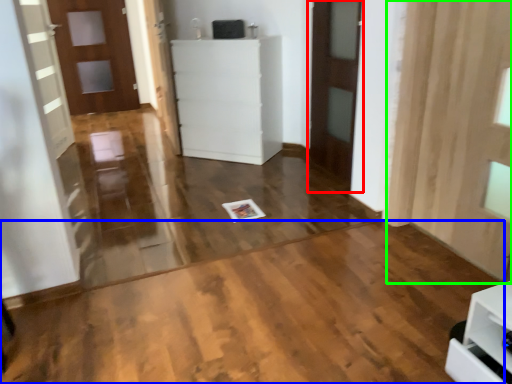
Question: Estimate the real-world distances between objects in this image. Which object is farther from door (highlighted by a red box), plywood (highlighted by a blue box) or curtain (highlighted by a green box)?

Choices:
 (A) plywood
 (B) curtain

Answer: (A)